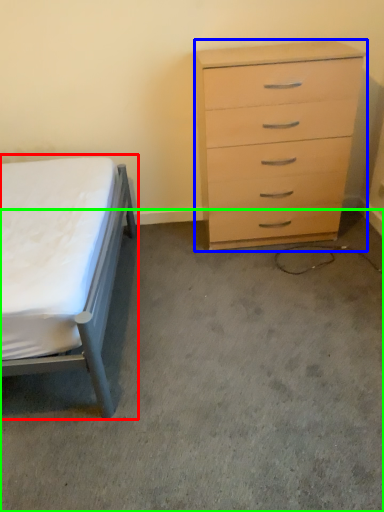
Question: Which is nearer to the bed (highlighted by a red box)? chest of drawers (highlighted by a blue box) or concrete (highlighted by a green box).

Choices:
 (A) chest of drawers
 (B) concrete

Answer: (B)